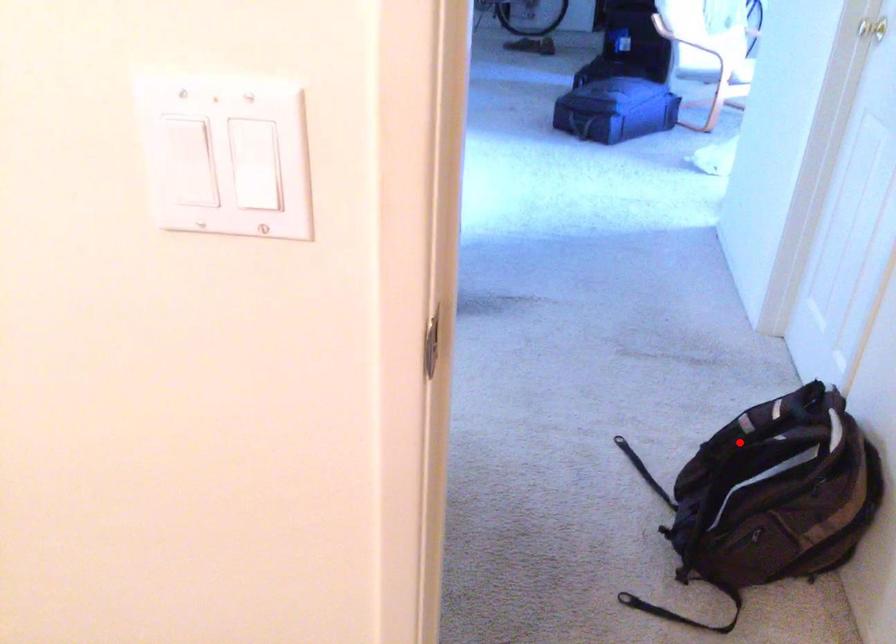
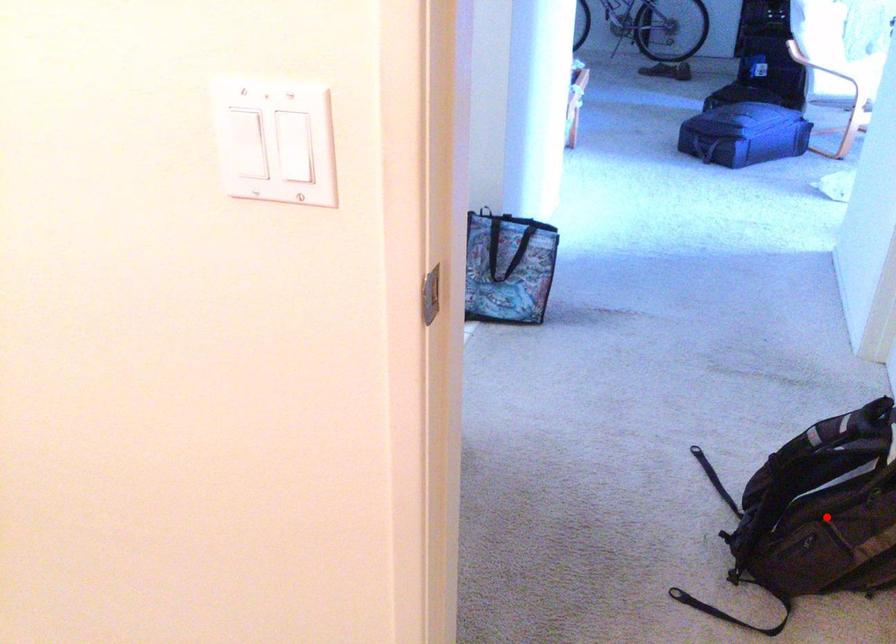
I am providing you with two images of the same scene from different viewpoints. A red point is marked on the first image and another point is marked on the second image. Is the marked point in image1 the same physical position as the marked point in image2?

No